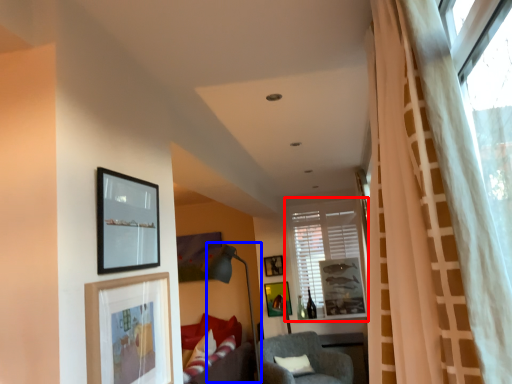
Question: Which point is closer to the camera, window (highlighted by a red box) or lamp (highlighted by a blue box)?

Choices:
 (A) window
 (B) lamp

Answer: (B)